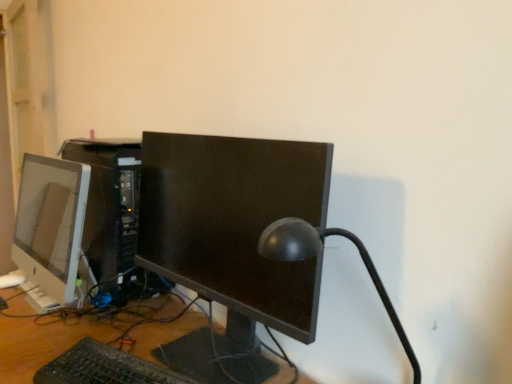
Find the location of a particular element. This screenshot has height=384, width=512. unoccupied space behind black plastic keyboard at lower center is located at coordinates (131, 326).